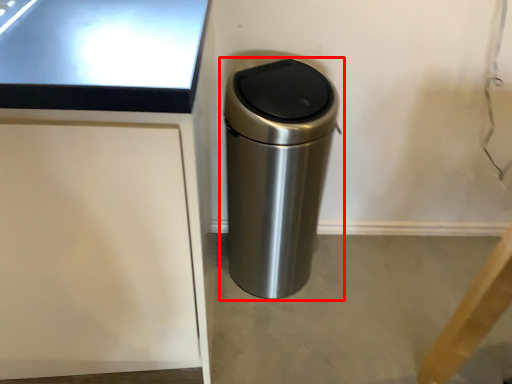
Question: Observing the image, what is the correct spatial positioning of waste container (annotated by the red box) in reference to concrete?

Choices:
 (A) left
 (B) right

Answer: (A)